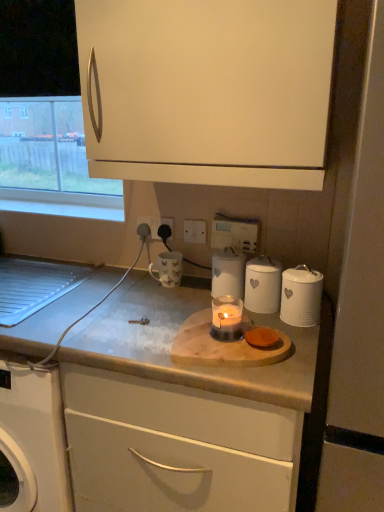
Question: From a real-world perspective, is clear glass window at upper left positioned under wooden cutting board at center based on gravity?

Choices:
 (A) no
 (B) yes

Answer: (A)

Question: Does clear glass window at upper left have a lesser width compared to wooden cutting board at center?

Choices:
 (A) no
 (B) yes

Answer: (B)

Question: Is wooden cutting board at center a part of clear glass window at upper left?

Choices:
 (A) yes
 (B) no

Answer: (B)

Question: Is clear glass window at upper left not within wooden cutting board at center?

Choices:
 (A) yes
 (B) no

Answer: (A)

Question: Considering the relative positions of clear glass window at upper left and wooden cutting board at center in the image provided, is clear glass window at upper left to the right of wooden cutting board at center from the viewer's perspective?

Choices:
 (A) yes
 (B) no

Answer: (B)

Question: Considering the positions of white matte cabinet at upper center, which ranks as the 1th cabinetry in top-to-bottom order, and wooden cutting board at center in the image, is white matte cabinet at upper center, which ranks as the 1th cabinetry in top-to-bottom order, taller or shorter than wooden cutting board at center?

Choices:
 (A) short
 (B) tall

Answer: (B)

Question: From a real-world perspective, relative to wooden cutting board at center, is white matte cabinet at upper center, which is the second cabinetry from bottom to top, vertically above or below?

Choices:
 (A) below
 (B) above

Answer: (B)

Question: Based on their positions, is white matte cabinet at upper center, which is the second cabinetry from bottom to top, located to the left or right of wooden cutting board at center?

Choices:
 (A) right
 (B) left

Answer: (B)

Question: Looking at the image, does white matte cabinet at upper center, which ranks as the 1th cabinetry in top-to-bottom order, seem bigger or smaller compared to wooden cutting board at center?

Choices:
 (A) big
 (B) small

Answer: (A)

Question: In the image, is matte white cutting board at center, arranged as the first cabinetry when ordered from the bottom, positioned in front of or behind white plastic electric outlet at center, acting as the second electric outlet starting from the left?

Choices:
 (A) behind
 (B) front

Answer: (B)

Question: From the image's perspective, is matte white cutting board at center, which appears as the 2th cabinetry when viewed from the top, above or below white plastic electric outlet at center, acting as the second electric outlet starting from the left?

Choices:
 (A) above
 (B) below

Answer: (B)

Question: Would you say matte white cutting board at center, which appears as the 2th cabinetry when viewed from the top, is to the left or to the right of white plastic electric outlet at center, positioned as the 1th electric outlet in right-to-left order, in the picture?

Choices:
 (A) right
 (B) left

Answer: (A)

Question: Considering the positions of point (109, 458) and point (198, 238), is point (109, 458) closer or farther from the camera than point (198, 238)?

Choices:
 (A) closer
 (B) farther

Answer: (A)

Question: Looking at the image, does white ceramic canister at center, marked as the 3th kitchen appliance in a right-to-left arrangement, seem bigger or smaller compared to clear glass window at upper left?

Choices:
 (A) small
 (B) big

Answer: (A)

Question: From the image's perspective, is white ceramic canister at center, marked as the first kitchen appliance in a left-to-right arrangement, positioned above or below clear glass window at upper left?

Choices:
 (A) above
 (B) below

Answer: (B)